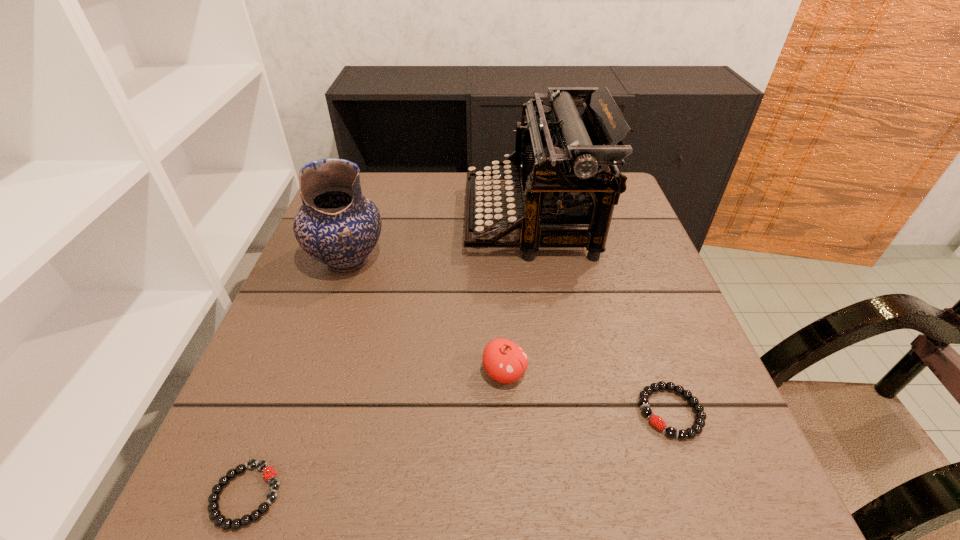
The image size is (960, 540). What are the coordinates of `the tallest object` in the screenshot? It's located at (565, 162).

Where is `pottery`? pottery is located at coordinates (336, 225).

Find the location of a particular element. The image size is (960, 540). apple is located at coordinates (504, 361).

Locate an element on the screen. The width and height of the screenshot is (960, 540). the farther bracelet is located at coordinates 699,422.

What are the coordinates of `the nearer bracelet` in the screenshot? It's located at (269, 474).

Where is `the nearest object`? the nearest object is located at coordinates (269, 474).

You are a GUI agent. You are given a task and a screenshot of the screen. Output one action in this format:
    pyautogui.click(x=<x>, y=<y>)
    Task: Click on the vacant space located on the typing side of the typewriter
    The image size is (960, 540).
    Given the screenshot: What is the action you would take?
    pyautogui.click(x=386, y=220)

You are a GUI agent. You are given a task and a screenshot of the screen. Output one action in this format:
    pyautogui.click(x=<x>, y=<y>)
    Task: Click on the vacant space located 0.080m on the typing side of the typewriter
    Image resolution: width=960 pixels, height=540 pixels.
    Given the screenshot: What is the action you would take?
    pyautogui.click(x=436, y=220)

In order to click on vacant space located on the typing side of the typewriter in this screenshot , I will do `click(390, 220)`.

The width and height of the screenshot is (960, 540). Identify the location of vacant space located on the right of the fourth shortest object. (549, 261).